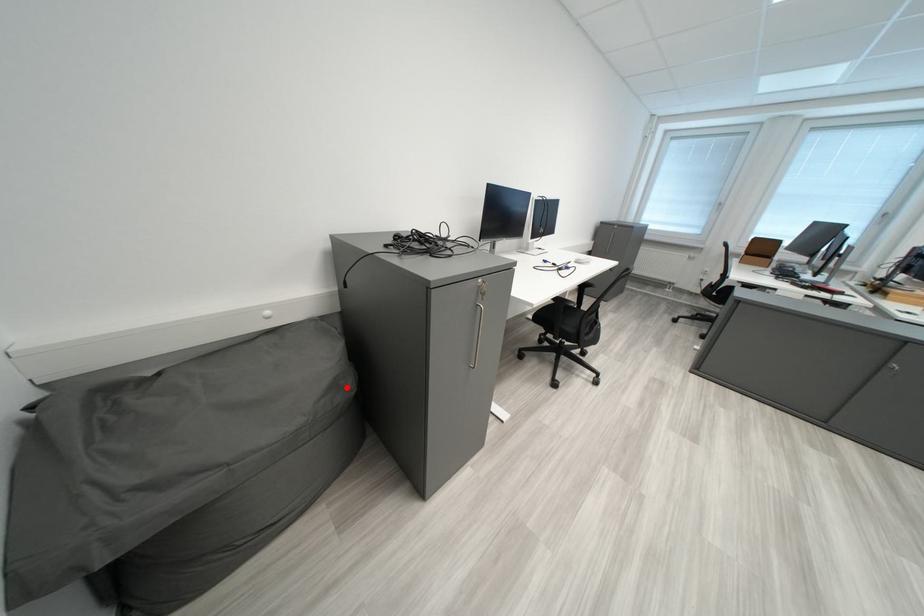
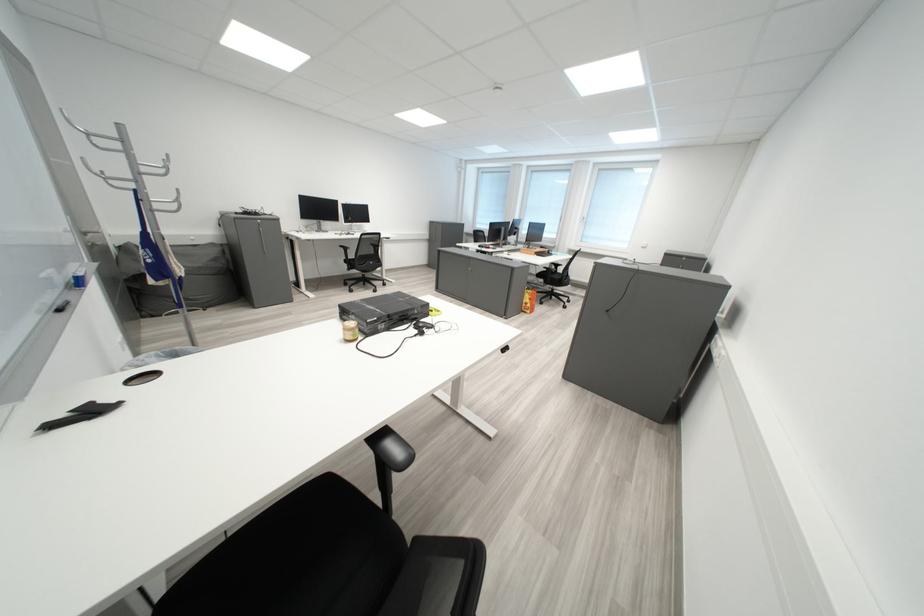
Question: I am providing you with two images of the same scene from different viewpoints. A red point is shown in image1. For the corresponding object point in image2, is it positioned nearer or farther from the camera?

Choices:
 (A) Nearer
 (B) Farther

Answer: (A)